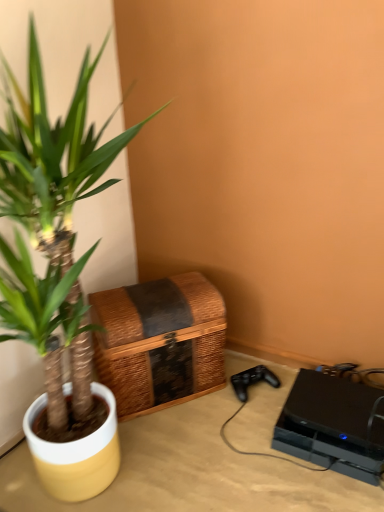
In order to click on blank space situated above black matte gaming console at lower right (from a real-world perspective) in this screenshot , I will do `click(323, 415)`.